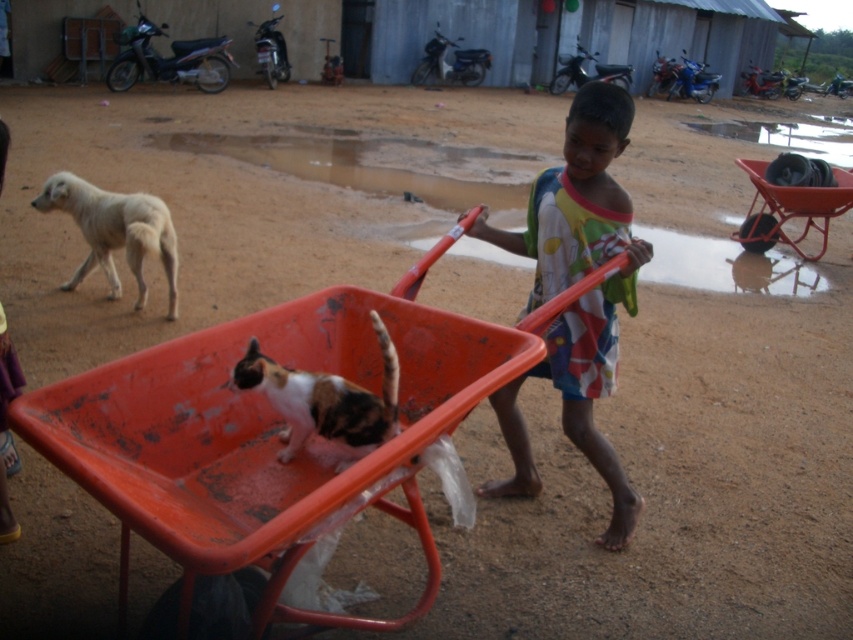
Looking at this image, you are a drone operator trying to locate the orange plastic cart at center in a rural outdoor scene. According to the coordinates provided, where would you direct the drone to find it?

The orange plastic cart at center is located at coordinates point (271, 433).

You are standing in the middle of the dirt path and see the orange plastic cart at center and the white fur dog at left. Which object is closer to your right side?

The orange plastic cart at center is closer to your right side because it is positioned to the right of the white fur dog at left.